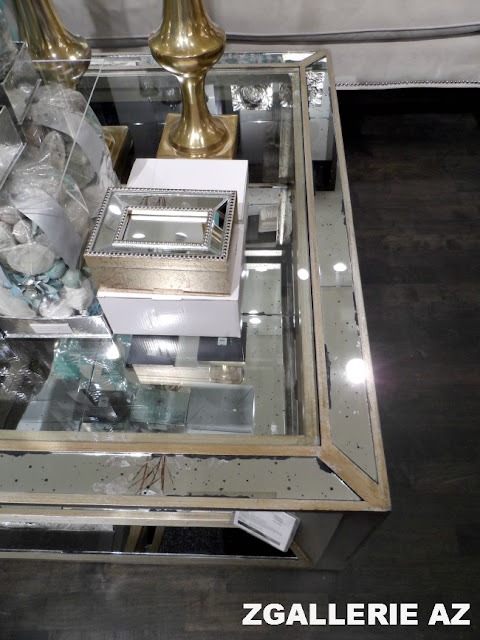
Identify the location of display counter. Image resolution: width=480 pixels, height=640 pixels. (286, 260).